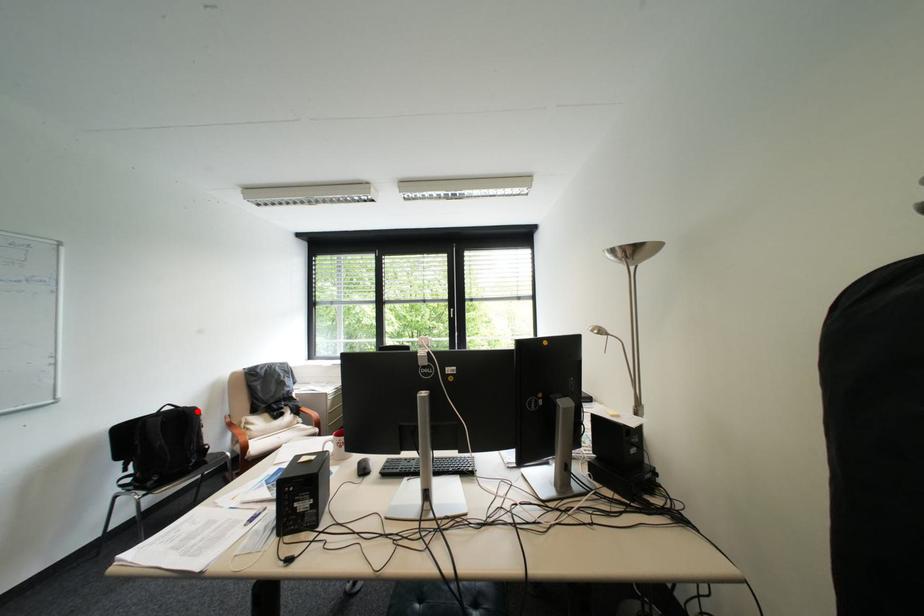
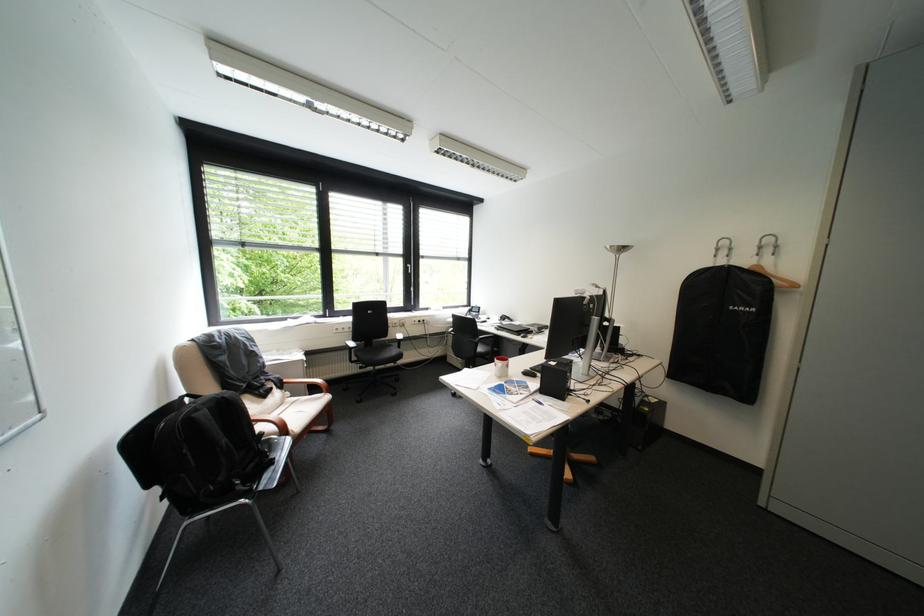
Locate, in the second image, the point that corresponds to the highlighted location in the first image.

(236, 398)